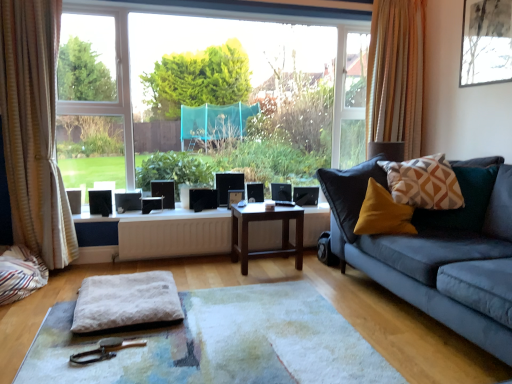
This screenshot has height=384, width=512. What are the coordinates of `free point below white matte radiator at center (from a real-world perspective)` in the screenshot? It's located at (164, 259).